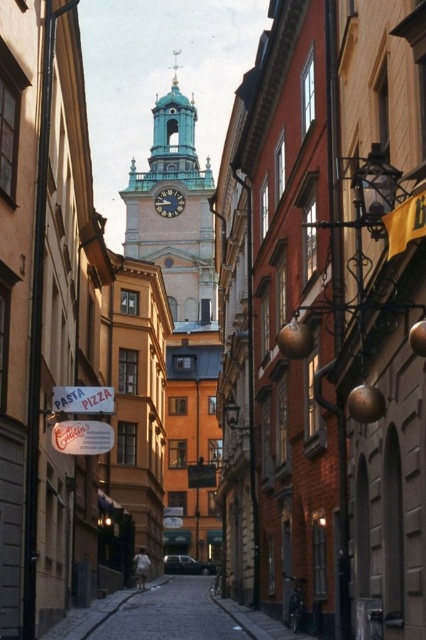
Which of these two, green stone clock tower at center or green patina clock at center, stands taller?

With more height is green stone clock tower at center.

Based on the photo, who is more distant from viewer, (203, 237) or (178, 195)?

The point (178, 195) is behind.

At what (x,y) coordinates should I click in order to perform the action: click on green stone clock tower at center. Please return your answer as a coordinate pair (x, y). Image resolution: width=426 pixels, height=640 pixels. Looking at the image, I should click on (178, 214).